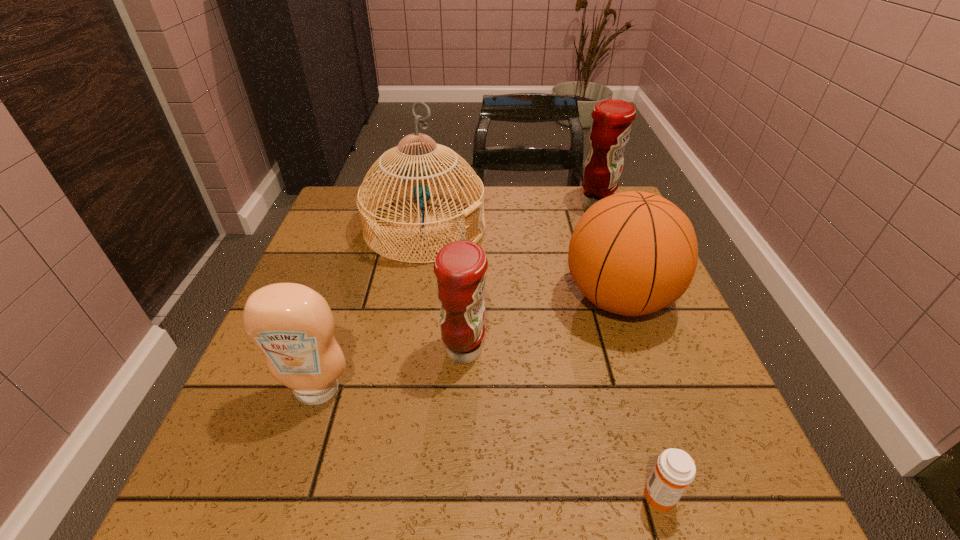
Locate an element on the screen. This screenshot has width=960, height=540. birdcage is located at coordinates 414,170.

The width and height of the screenshot is (960, 540). In order to click on the rightmost condiment in this screenshot , I will do (x=612, y=119).

You are a GUI agent. You are given a task and a screenshot of the screen. Output one action in this format:
    pyautogui.click(x=<x>, y=<y>)
    Task: Click on the farthest condiment
    The height and width of the screenshot is (540, 960).
    Given the screenshot: What is the action you would take?
    pyautogui.click(x=612, y=119)

In order to click on basketball in this screenshot , I will do `click(632, 253)`.

Find the location of `the leftmost condiment`. the leftmost condiment is located at coordinates (293, 326).

The height and width of the screenshot is (540, 960). What are the coordinates of `the second condiment from right to left` in the screenshot? It's located at (460, 266).

You are a GUI agent. You are given a task and a screenshot of the screen. Output one action in this format:
    pyautogui.click(x=<x>, y=<y>)
    Task: Click on the nearest object
    
    Given the screenshot: What is the action you would take?
    pyautogui.click(x=675, y=469)

Find the location of a particular element. The width and height of the screenshot is (960, 540). the shortest object is located at coordinates (675, 469).

Locate an element on the screen. free space located 0.100m on the right of the birdcage is located at coordinates (522, 227).

Locate an element on the screen. The width and height of the screenshot is (960, 540). vacant space located on the front of the farthest condiment is located at coordinates (630, 295).